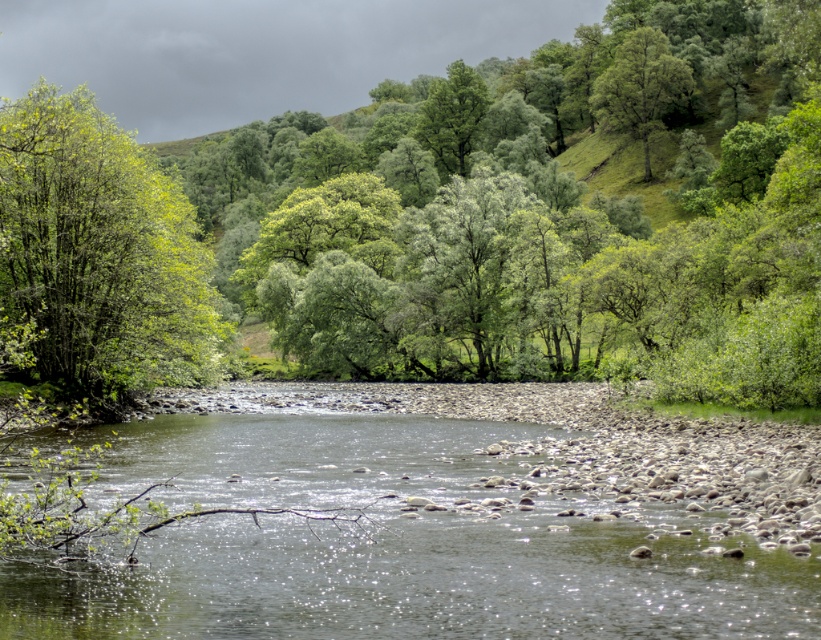
You are standing at the riverbank and looking towards the trees. Which tree is closer to you, the green leafy tree at left or the green leafy tree at upper right?

The green leafy tree at left is closer to you because it is in front of the green leafy tree at upper right.